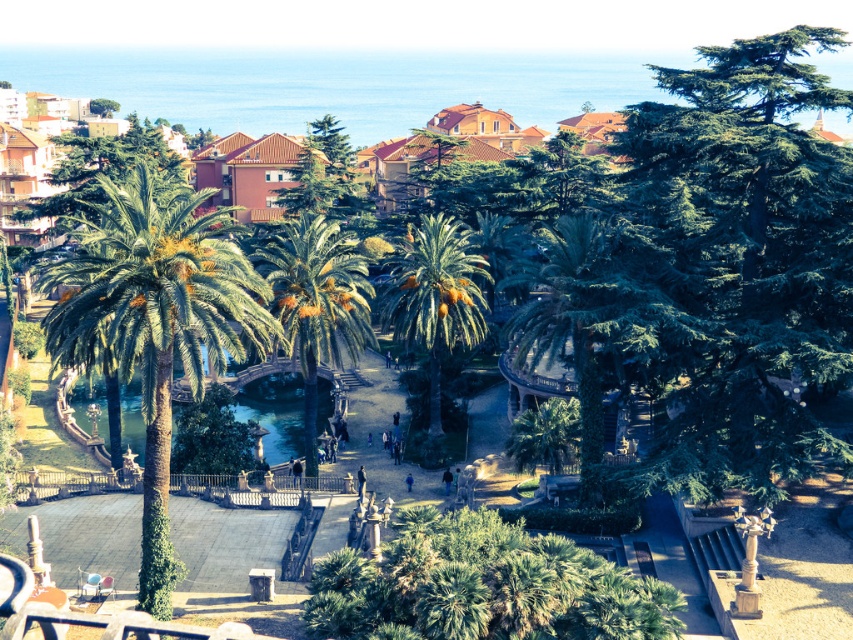
Question: Among these objects, which one is nearest to the camera?

Choices:
 (A) green glossy water at center
 (B) green leafy palm at center
 (C) green leafy palm tree at left
 (D) green leafy palm tree at center

Answer: (C)

Question: Which point is closer to the camera?

Choices:
 (A) green glossy water at center
 (B) green leafy palm tree at center
 (C) green leafy palm tree at left

Answer: (C)

Question: Can you confirm if green leafy palm at center is smaller than green glossy water at center?

Choices:
 (A) yes
 (B) no

Answer: (B)

Question: Does green leafy palm at center have a larger size compared to green glossy water at center?

Choices:
 (A) yes
 (B) no

Answer: (A)

Question: Which of the following is the closest to the observer?

Choices:
 (A) green leafy palm at center
 (B) green leafy palm tree at left

Answer: (B)

Question: Can you confirm if green leafy palm tree at left is thinner than green glossy water at center?

Choices:
 (A) no
 (B) yes

Answer: (A)